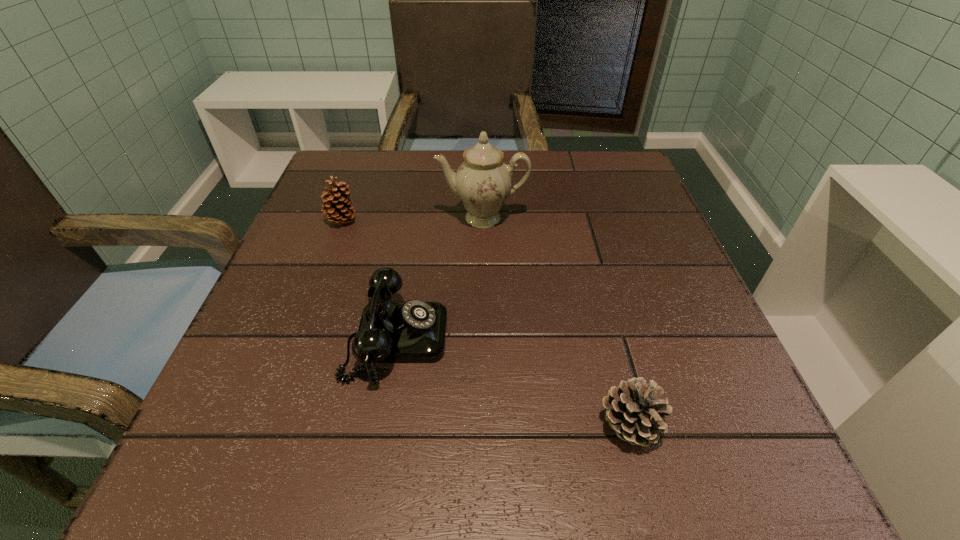
Where is `vacant point located between the left pinecone and the chinaware`? This screenshot has width=960, height=540. vacant point located between the left pinecone and the chinaware is located at coordinates (412, 220).

Locate an element on the screen. Image resolution: width=960 pixels, height=540 pixels. the third closest object to the rightmost object is located at coordinates (339, 209).

Locate which object is the closest to the tallest object. Please provide its 2D coordinates. Your answer should be formatted as a tuple, i.e. [(x, y)], where the tuple contains the x and y coordinates of a point satisfying the conditions above.

[(414, 331)]

This screenshot has height=540, width=960. What are the coordinates of `free spot that satisfies the following two spatial constraints: 1. on the spout of the chinaware; 2. on the dial of the third farthest object` in the screenshot? It's located at (483, 339).

This screenshot has width=960, height=540. Identify the location of vacant space that satisfies the following two spatial constraints: 1. on the spout of the rightmost object; 2. on the left side of the tallest object. [484, 425].

This screenshot has height=540, width=960. Find the location of `vacant point that satisfies the following two spatial constraints: 1. on the dial of the second nearest object; 2. on the left side of the shorter pinecone`. vacant point that satisfies the following two spatial constraints: 1. on the dial of the second nearest object; 2. on the left side of the shorter pinecone is located at coordinates (381, 425).

Where is `free region that satisfies the following two spatial constraints: 1. on the spout of the shorter pinecone; 2. on the left side of the tallest object`? The height and width of the screenshot is (540, 960). free region that satisfies the following two spatial constraints: 1. on the spout of the shorter pinecone; 2. on the left side of the tallest object is located at coordinates (484, 425).